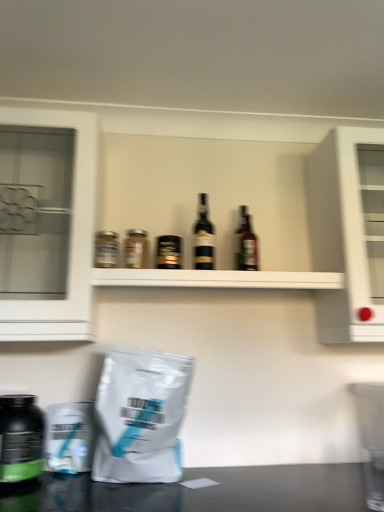
Identify the location of vacant space situated above white glass cabinet at left, which is counted as the 2th cabinetry, starting from the right (from a real-world perspective). Image resolution: width=384 pixels, height=512 pixels. (42, 130).